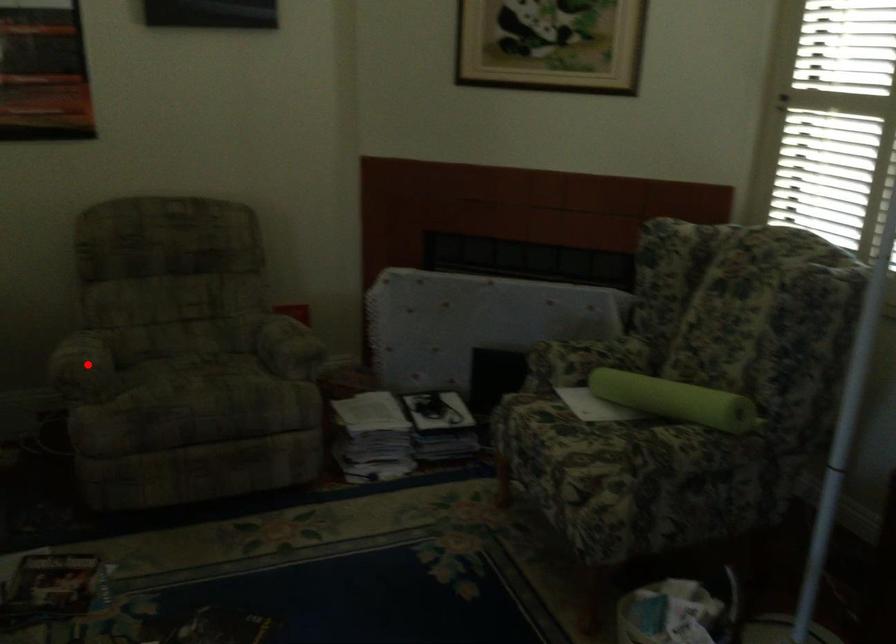
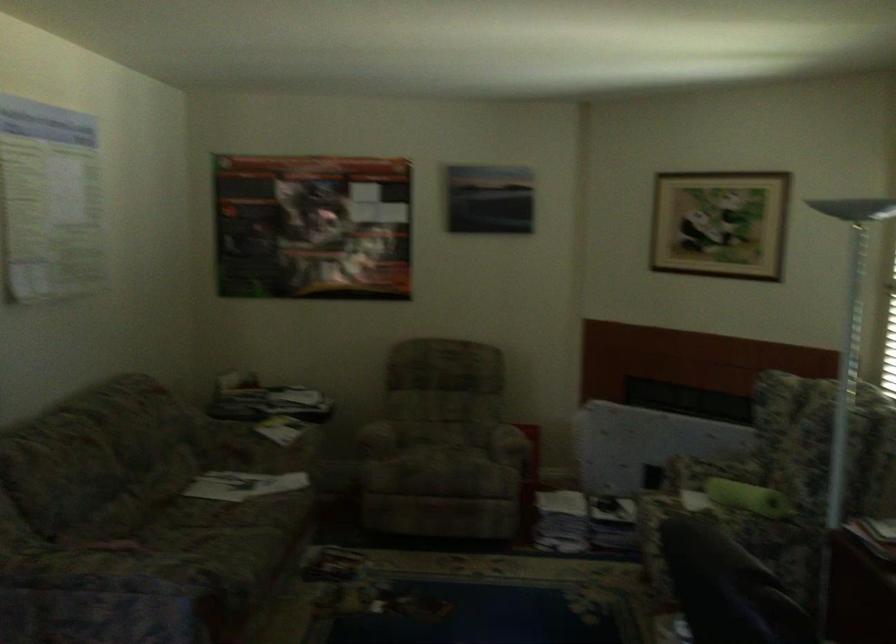
Question: I am providing you with two images of the same scene from different viewpoints. A red point is shown in image1. For the corresponding object point in image2, is it positioned nearer or farther from the camera?

Choices:
 (A) Nearer
 (B) Farther

Answer: (B)